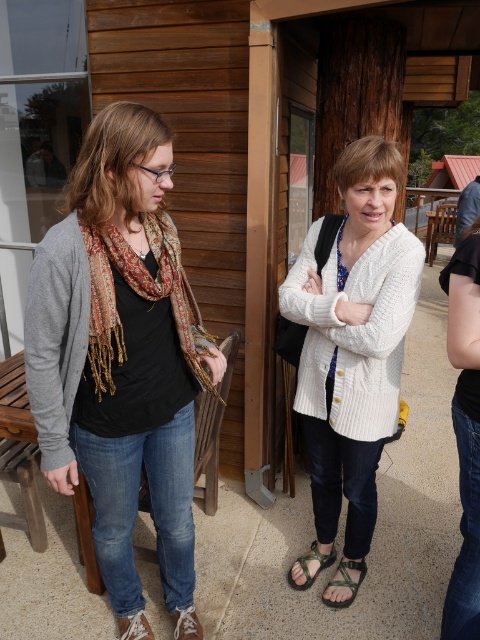
You are a photographer trying to capture a closeup of the green fabric sandal at lower center and camouflage fabric sandal at lower center. Which sandal should you zoom in on first to ensure it fits within your camera frame?

The green fabric sandal at lower center should be zoomed in on first because it is smaller in size compared to the camouflage fabric sandal at lower center, so it requires more precise framing to capture its details.

You are trying to decide which sandal to wear based on their widths. Which sandal has a narrower width between the green fabric sandal at lower center and the camouflage fabric sandal at lower center?

The green fabric sandal at lower center has a lesser width compared to the camouflage fabric sandal at lower center, so it is narrower.

Based on the scene description, which object is taller between the white knitted cardigan at center and the camouflage fabric sandal at lower center?

The white knitted cardigan at center is taller than the camouflage fabric sandal at lower center according to the description.